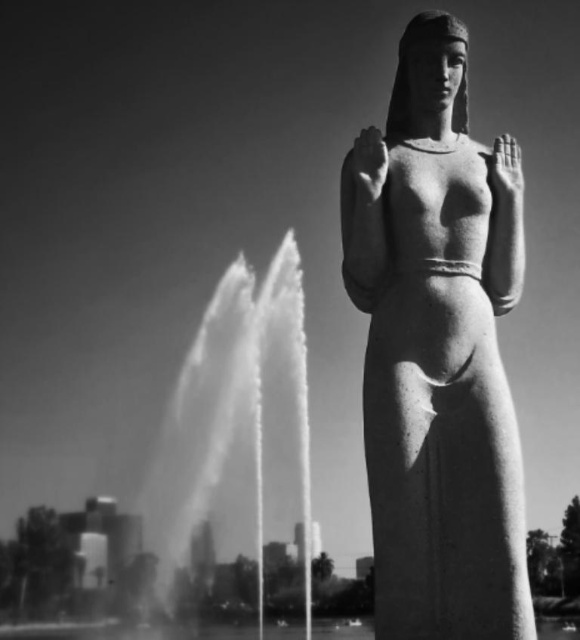
You are an artist planning to sketch this scene. You want to ensure the proportions between the granite statue at center and the clear water at center are accurate. Which object should you draw first to establish the correct scale?

The clear water at center has a greater width than the granite statue at center. Therefore, you should draw the clear water at center first to establish the correct scale, as it is wider and will help in proportioning the narrower statue accordingly.

You are standing in front of the statue and want to take a photo of the clear water at center and the smooth stone hand at upper center. Which object will appear larger in your photo?

The clear water at center will appear larger in your photo because it is closer to the viewer than the smooth stone hand at upper center.